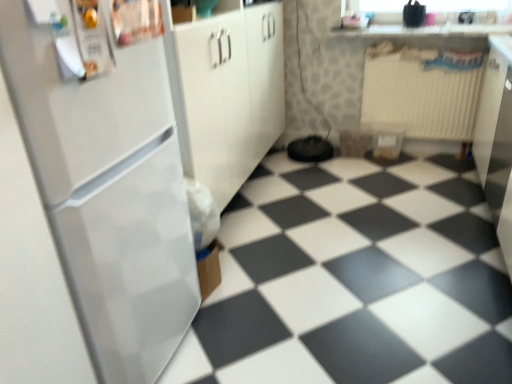
Question: Is white plastic radiator at upper right oriented towards white glossy tile at lower left?

Choices:
 (A) no
 (B) yes

Answer: (B)

Question: Is white plastic radiator at upper right further to the viewer compared to white glossy tile at lower left?

Choices:
 (A) no
 (B) yes

Answer: (B)

Question: Would you say white plastic radiator at upper right is outside white glossy tile at lower left?

Choices:
 (A) no
 (B) yes

Answer: (B)

Question: Does white plastic radiator at upper right appear on the left side of white glossy tile at lower left?

Choices:
 (A) yes
 (B) no

Answer: (B)

Question: Is white plastic radiator at upper right positioned far away from white glossy tile at lower left?

Choices:
 (A) no
 (B) yes

Answer: (B)

Question: Is white glossy countertop at upper center situated inside white glossy refrigerator at left or outside?

Choices:
 (A) inside
 (B) outside

Answer: (B)

Question: Considering their positions, is white glossy countertop at upper center located in front of or behind white glossy refrigerator at left?

Choices:
 (A) behind
 (B) front

Answer: (A)

Question: In terms of size, does white glossy countertop at upper center appear bigger or smaller than white glossy refrigerator at left?

Choices:
 (A) small
 (B) big

Answer: (A)

Question: Considering the positions of white glossy countertop at upper center and white glossy refrigerator at left in the image, is white glossy countertop at upper center taller or shorter than white glossy refrigerator at left?

Choices:
 (A) tall
 (B) short

Answer: (B)

Question: In terms of height, does white plastic radiator at upper right look taller or shorter compared to white glossy tile at lower left?

Choices:
 (A) tall
 (B) short

Answer: (A)

Question: Based on their sizes in the image, would you say white plastic radiator at upper right is bigger or smaller than white glossy tile at lower left?

Choices:
 (A) big
 (B) small

Answer: (B)

Question: Is white plastic radiator at upper right spatially inside white glossy tile at lower left, or outside of it?

Choices:
 (A) outside
 (B) inside

Answer: (A)

Question: From the image's perspective, is white plastic radiator at upper right positioned above or below white glossy tile at lower left?

Choices:
 (A) above
 (B) below

Answer: (A)

Question: From the image's perspective, relative to white glossy countertop at upper center, is white glossy tile at lower left above or below?

Choices:
 (A) above
 (B) below

Answer: (B)

Question: In terms of height, does white glossy tile at lower left look taller or shorter compared to white glossy countertop at upper center?

Choices:
 (A) tall
 (B) short

Answer: (A)